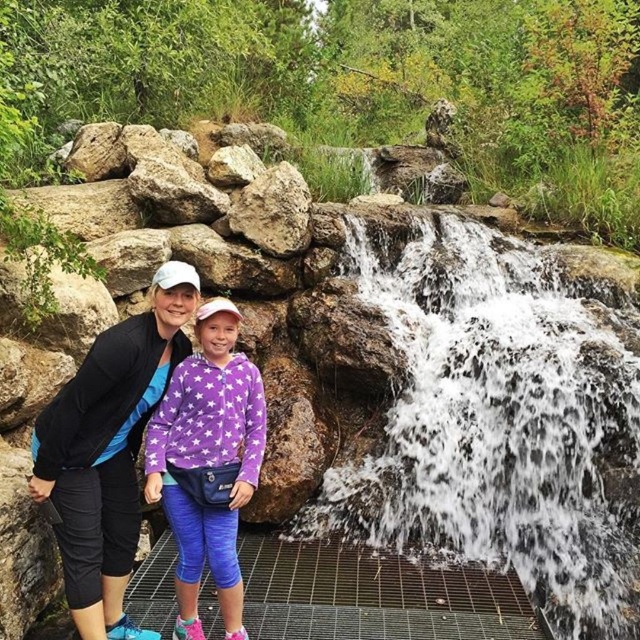
Question: Can you confirm if matte black jacket at left is positioned to the left of purple fleece jacket at center?

Choices:
 (A) no
 (B) yes

Answer: (B)

Question: Is matte black jacket at left below gray rough rock at center?

Choices:
 (A) no
 (B) yes

Answer: (B)

Question: Which point is closer to the camera?

Choices:
 (A) (520, 353)
 (B) (285, 205)

Answer: (A)

Question: Can you confirm if white frothy water at center is positioned above matte black jacket at left?

Choices:
 (A) yes
 (B) no

Answer: (B)

Question: Among these objects, which one is farthest from the camera?

Choices:
 (A) purple fleece jacket at center
 (B) white frothy water at center
 (C) gray rough rock at center

Answer: (C)

Question: Estimate the real-world distances between objects in this image. Which object is closer to the gray rough rock at center?

Choices:
 (A) purple fleece jacket at center
 (B) white frothy water at center
 (C) matte black jacket at left

Answer: (B)